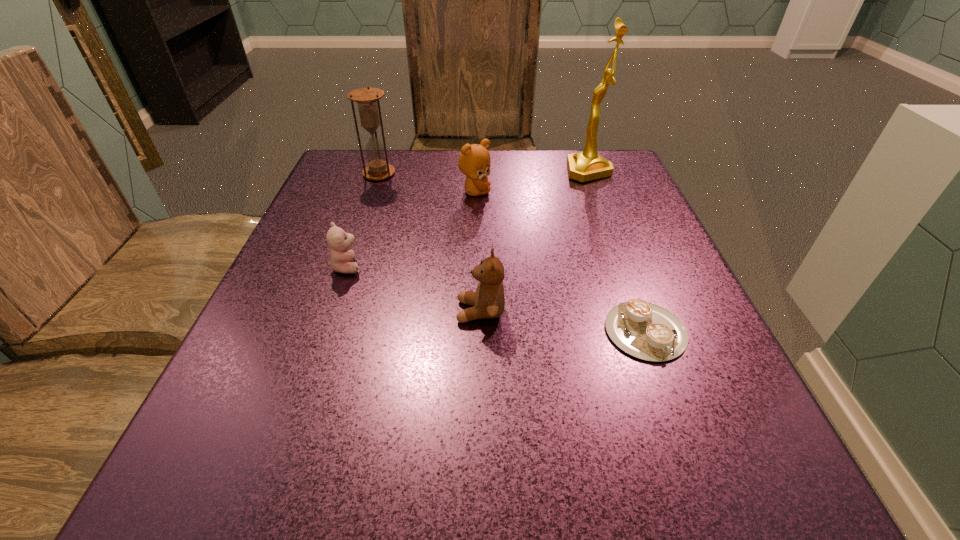
The width and height of the screenshot is (960, 540). I want to click on object that is the fifth nearest to the second tallest object, so click(x=647, y=331).

This screenshot has height=540, width=960. I want to click on object that is the fifth closest to the third nearest object, so click(588, 165).

Find the location of a particular element. Image resolution: width=960 pixels, height=540 pixels. teddy bear that is the closest to the leftmost teddy bear is located at coordinates (488, 301).

Identify the location of teddy bear object that ranks as the closest to the nearest teddy bear. (341, 257).

This screenshot has width=960, height=540. I want to click on vacant space that satisfies the following two spatial constraints: 1. at the face of the shortest object; 2. on the right side of the leftmost teddy bear, so click(324, 331).